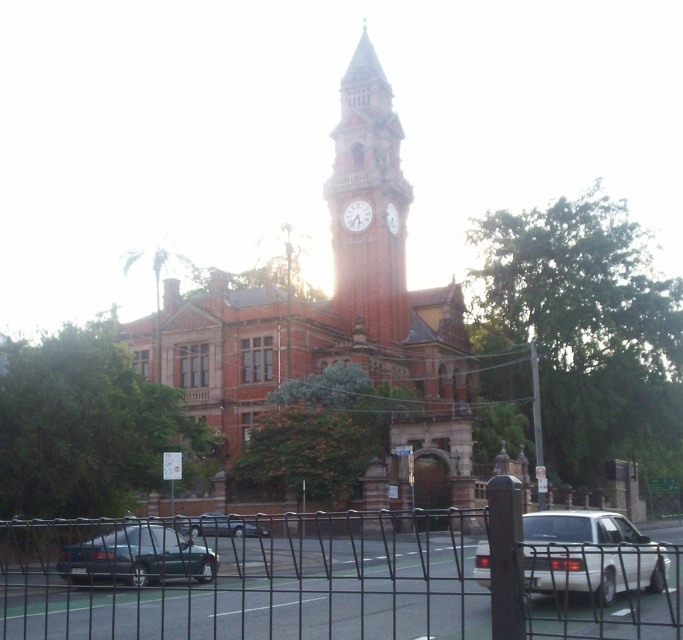
Which is more to the right, white glossy clock at center or white matte clock at center?

Positioned to the right is white matte clock at center.

Is white glossy clock at center in front of white matte clock at center?

No, white glossy clock at center is further to the viewer.

Between point (342, 214) and point (393, 218), which one is positioned behind?

The point (393, 218) is more distant.

Locate an element on the screen. white glossy clock at center is located at coordinates (357, 216).

Is white matte sedan at lower right closer to camera compared to white matte clock at center?

Yes, it is in front of white matte clock at center.

Does white matte sedan at lower right appear under white matte clock at center?

Yes, white matte sedan at lower right is below white matte clock at center.

Identify the location of white matte sedan at lower right. (589, 554).

Find the location of a particular element. white matte sedan at lower right is located at coordinates (589, 554).

At what (x,y) coordinates should I click in order to perform the action: click on metal wire fence at center. Please return your answer as a coordinate pair (x, y). Looking at the image, I should click on (247, 579).

Does metal wire fence at center have a greater width compared to metallic silver sedan at lower center?

Correct, the width of metal wire fence at center exceeds that of metallic silver sedan at lower center.

This screenshot has height=640, width=683. What do you see at coordinates (247, 579) in the screenshot?
I see `metal wire fence at center` at bounding box center [247, 579].

I want to click on metal wire fence at center, so click(247, 579).